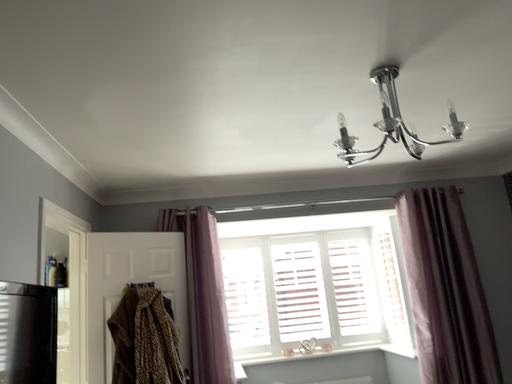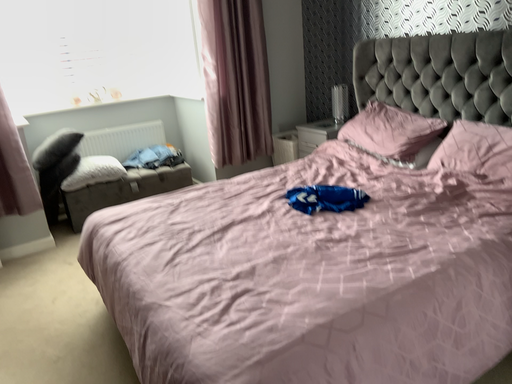
Question: How did the camera likely rotate when shooting the video?

Choices:
 (A) rotated left
 (B) rotated right

Answer: (B)